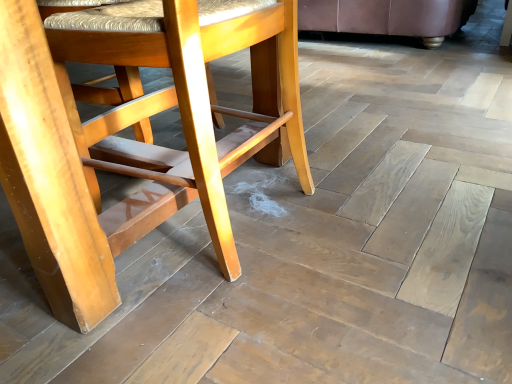
Question: Considering the relative sizes of light brown wood chair at center, the first chair from the bottom, and wooden chair at upper right, acting as the 1th chair starting from the top, in the image provided, is light brown wood chair at center, the first chair from the bottom, taller than wooden chair at upper right, acting as the 1th chair starting from the top,?

Choices:
 (A) yes
 (B) no

Answer: (A)

Question: From a real-world perspective, is light brown wood chair at center, the first chair from the bottom, located beneath wooden chair at upper right, acting as the 1th chair starting from the top?

Choices:
 (A) no
 (B) yes

Answer: (A)

Question: From the image's perspective, is light brown wood chair at center, which ranks as the 1th chair in front-to-back order, located beneath wooden chair at upper right, which appears as the 2th chair when viewed from the front?

Choices:
 (A) no
 (B) yes

Answer: (B)

Question: Would you consider light brown wood chair at center, the first chair from the bottom, to be distant from wooden chair at upper right, which appears as the 2th chair when viewed from the front?

Choices:
 (A) yes
 (B) no

Answer: (A)

Question: From the image's perspective, is light brown wood chair at center, which ranks as the 1th chair in front-to-back order, above wooden chair at upper right, positioned as the second chair in bottom-to-top order?

Choices:
 (A) yes
 (B) no

Answer: (B)

Question: Does light brown wood chair at center, which ranks as the 1th chair in front-to-back order, lie behind wooden chair at upper right, positioned as the second chair in bottom-to-top order?

Choices:
 (A) yes
 (B) no

Answer: (B)

Question: Does wooden chair at upper right, which appears as the 2th chair when viewed from the front, have a lesser width compared to light brown wood chair at center, which ranks as the 1th chair in front-to-back order?

Choices:
 (A) yes
 (B) no

Answer: (B)

Question: Are wooden chair at upper right, acting as the 1th chair starting from the top, and light brown wood chair at center, which ranks as the 1th chair in front-to-back order, located far from each other?

Choices:
 (A) no
 (B) yes

Answer: (B)

Question: Is wooden chair at upper right, acting as the 1th chair starting from the top, wider than light brown wood chair at center, which is counted as the second chair, starting from the back?

Choices:
 (A) no
 (B) yes

Answer: (B)

Question: From the image's perspective, is wooden chair at upper right, acting as the 1th chair starting from the top, on top of light brown wood chair at center, which ranks as the 1th chair in front-to-back order?

Choices:
 (A) yes
 (B) no

Answer: (A)

Question: Is wooden chair at upper right, acting as the 1th chair starting from the top, taller than light brown wood chair at center, the first chair from the bottom?

Choices:
 (A) no
 (B) yes

Answer: (A)

Question: Can you see wooden chair at upper right, acting as the 1th chair starting from the top, touching light brown wood chair at center, which ranks as the second chair in top-to-bottom order?

Choices:
 (A) yes
 (B) no

Answer: (B)

Question: Is light brown wood chair at center, which is counted as the second chair, starting from the back, in front of or behind wooden chair at upper right, which appears as the 2th chair when viewed from the front, in the image?

Choices:
 (A) behind
 (B) front

Answer: (B)